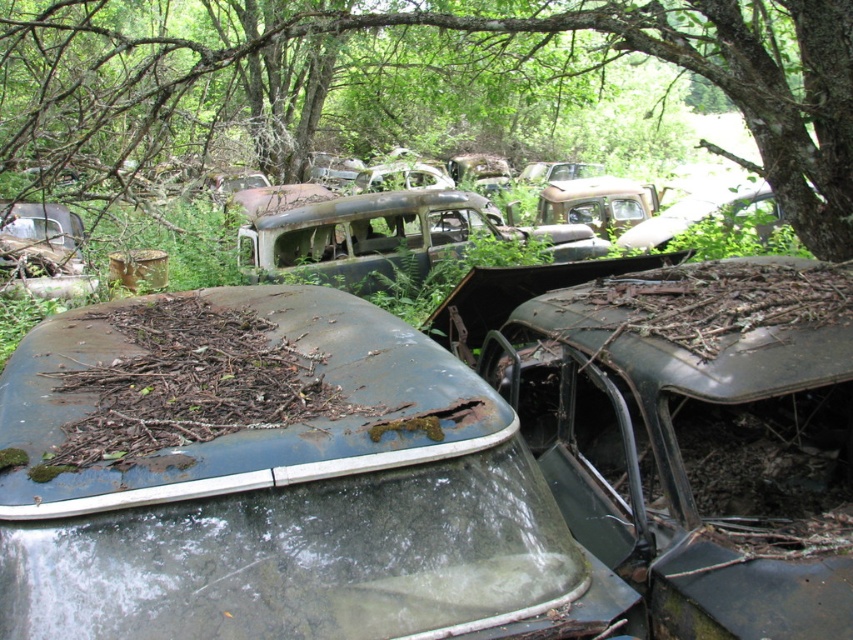
Who is lower down, green rough bark tree at upper center or rusty metal roof at center?

rusty metal roof at center is lower down.

Who is positioned more to the right, green rough bark tree at upper center or rusty metal roof at center?

Positioned to the right is rusty metal roof at center.

Where is `green rough bark tree at upper center`? The image size is (853, 640). green rough bark tree at upper center is located at coordinates (436, 32).